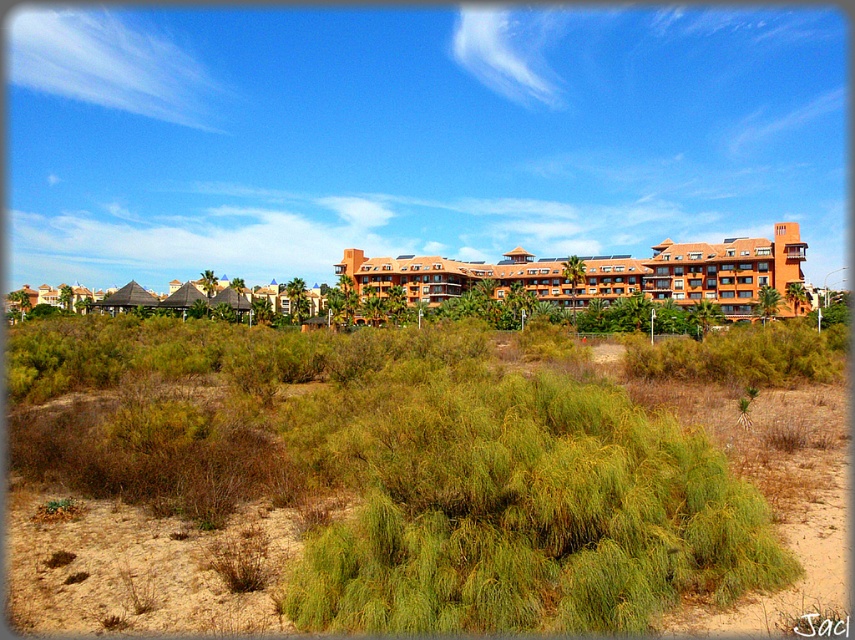
Question: Can you confirm if green shrubbery at center is thinner than orange clay resort at center?

Choices:
 (A) yes
 (B) no

Answer: (A)

Question: Does green shrubbery at center appear under orange clay resort at center?

Choices:
 (A) yes
 (B) no

Answer: (A)

Question: Where is green shrubbery at center located in relation to orange clay resort at center in the image?

Choices:
 (A) below
 (B) above

Answer: (A)

Question: Among these objects, which one is nearest to the camera?

Choices:
 (A) green shrubbery at center
 (B) orange clay resort at center

Answer: (A)